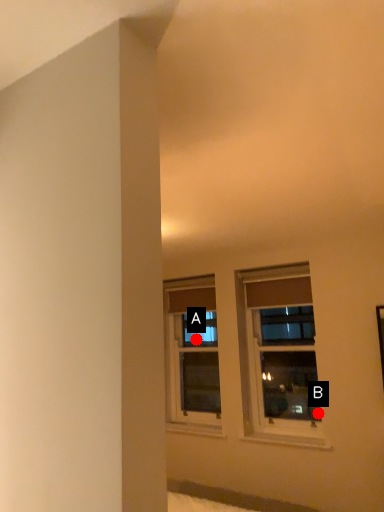
Question: Two points are circled on the image, labeled by A and B beside each circle. Which point appears closest to the camera in this image?

Choices:
 (A) A is closer
 (B) B is closer

Answer: (B)